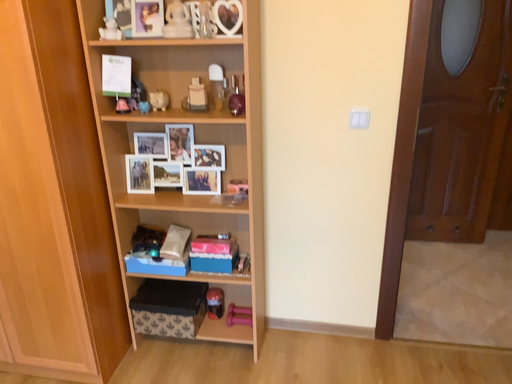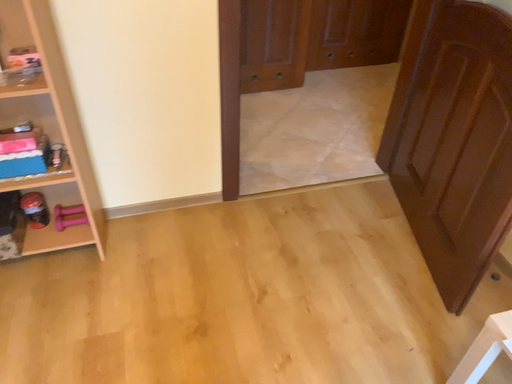
Question: How did the camera likely rotate when shooting the video?

Choices:
 (A) rotated left
 (B) rotated right

Answer: (B)